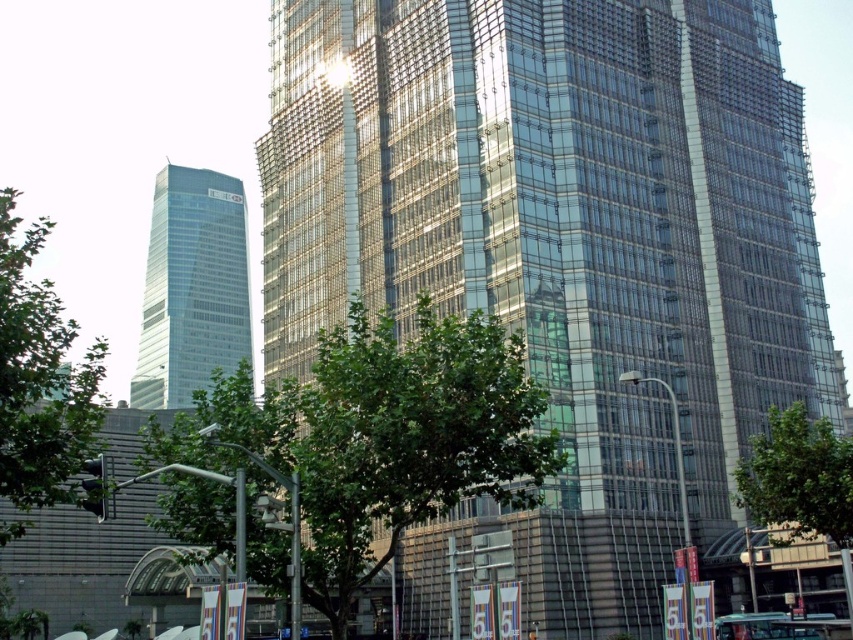
Looking at this image, can you confirm if transparent glass building at center is smaller than green leafy tree at center?

Actually, transparent glass building at center might be larger than green leafy tree at center.

From the picture: Does transparent glass building at center have a greater height compared to green leafy tree at center?

Yes, transparent glass building at center is taller than green leafy tree at center.

Is point (747, 269) positioned behind point (483, 488)?

Yes, it is behind point (483, 488).

The height and width of the screenshot is (640, 853). Find the location of `transparent glass building at center`. transparent glass building at center is located at coordinates (561, 230).

Between green leafy tree at center and metallic silver car at center, which one appears on the right side from the viewer's perspective?

metallic silver car at center is more to the right.

Is point (328, 499) in front of point (776, 627)?

Yes, it is in front of point (776, 627).

The height and width of the screenshot is (640, 853). I want to click on green leafy tree at center, so [381, 436].

I want to click on clear glass skyscraper at left, so click(x=192, y=285).

Is point (196, 184) positioned behind point (755, 618)?

Yes, it is behind point (755, 618).

Where is `clear glass skyscraper at left`? The width and height of the screenshot is (853, 640). clear glass skyscraper at left is located at coordinates (192, 285).